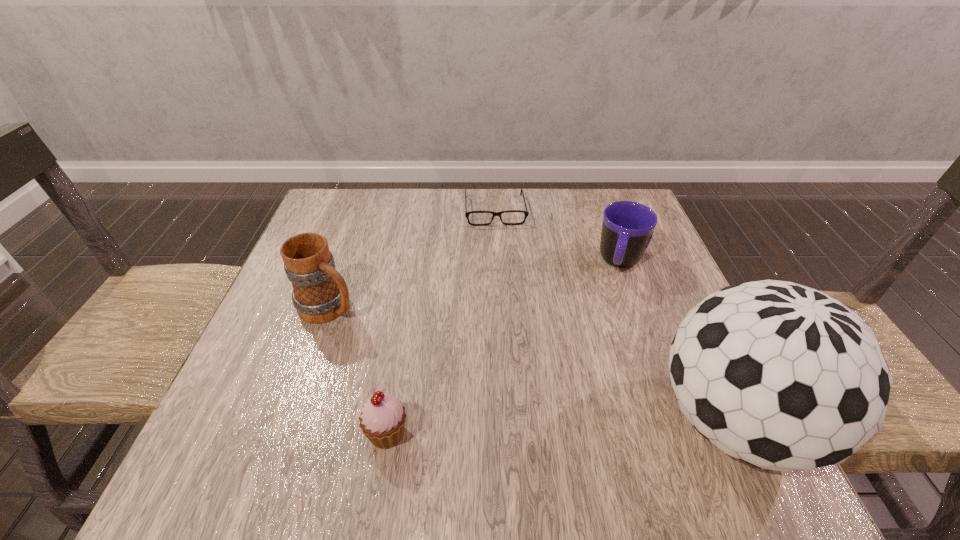
Locate an element on the screen. The height and width of the screenshot is (540, 960). free space at the far left corner is located at coordinates (342, 218).

You are a GUI agent. You are given a task and a screenshot of the screen. Output one action in this format:
    pyautogui.click(x=<x>, y=<y>)
    Task: Click on the vacant space at the near left corner of the desktop
    
    Given the screenshot: What is the action you would take?
    pyautogui.click(x=247, y=424)

In the image, there is a desktop. What are the coordinates of `vacant space at the far right corner` in the screenshot? It's located at tap(624, 189).

I want to click on unoccupied area between the soccer ball and the third farthest object, so click(532, 364).

Locate an element on the screen. The width and height of the screenshot is (960, 540). unoccupied position between the soccer ball and the nearer mug is located at coordinates (532, 364).

I want to click on free space between the cupcake and the tallest object, so click(x=561, y=427).

Where is `unoccupied area between the left mug and the tallest object`? unoccupied area between the left mug and the tallest object is located at coordinates (532, 364).

Identify the location of free space between the spectacles and the right mug. (558, 236).

Find the location of `free space between the cupcake and the fourth nearest object`. free space between the cupcake and the fourth nearest object is located at coordinates (504, 348).

Locate an element on the screen. Image resolution: width=960 pixels, height=540 pixels. vacant space in between the cupcake and the right mug is located at coordinates (504, 348).